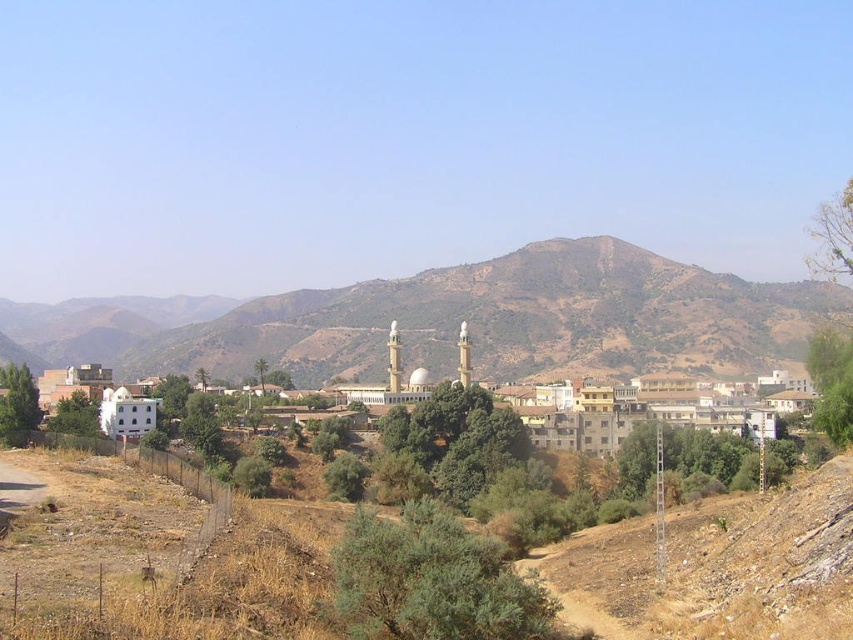
Does brown rocky mountain at center appear on the left side of white matte building at center?

Indeed, brown rocky mountain at center is positioned on the left side of white matte building at center.

Is brown rocky mountain at center shorter than white matte building at center?

No, brown rocky mountain at center is not shorter than white matte building at center.

Is point (585, 305) farther from camera compared to point (560, 435)?

Yes, it is.

At what (x,y) coordinates should I click in order to perform the action: click on brown rocky mountain at center. Please return your answer as a coordinate pair (x, y). Looking at the image, I should click on (456, 320).

Which is below, brown dirt track at lower center or brown rocky mountain at center?

brown dirt track at lower center is below.

Does brown dirt track at lower center have a lesser width compared to brown rocky mountain at center?

Correct, brown dirt track at lower center's width is less than brown rocky mountain at center's.

Locate an element on the screen. The height and width of the screenshot is (640, 853). brown dirt track at lower center is located at coordinates pos(161,557).

Where is `brown dirt track at lower center`? brown dirt track at lower center is located at coordinates (161, 557).

Who is lower down, brown dirt track at lower center or white matte building at center?

brown dirt track at lower center is below.

Can you confirm if brown dirt track at lower center is taller than white matte building at center?

No, brown dirt track at lower center is not taller than white matte building at center.

Does point (699, 612) lie behind point (471, 355)?

No, (699, 612) is in front of (471, 355).

Where is `brown dirt track at lower center`? Image resolution: width=853 pixels, height=640 pixels. brown dirt track at lower center is located at coordinates (161, 557).